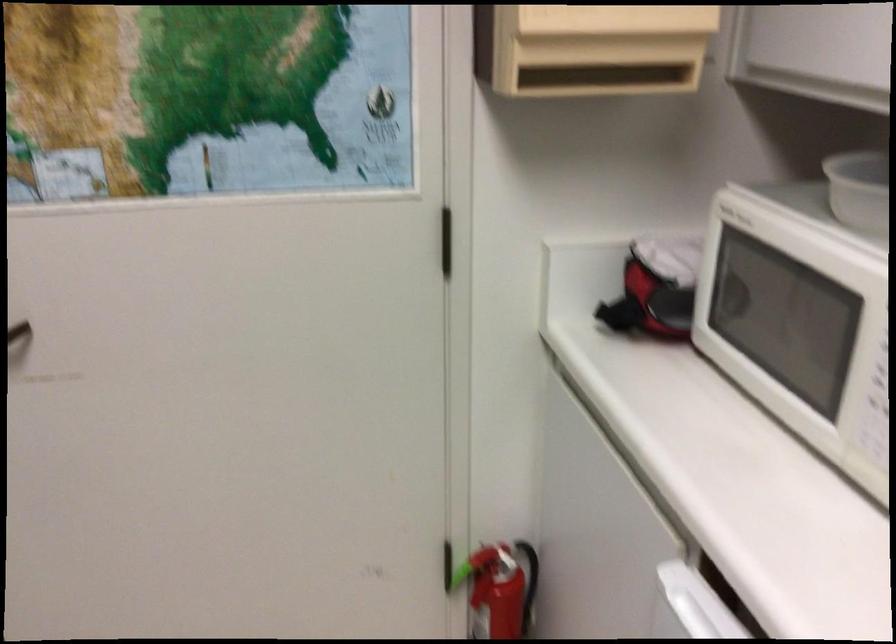
Question: How did the camera likely rotate?

Choices:
 (A) Left
 (B) Right
 (C) Up
 (D) Down

Answer: (A)